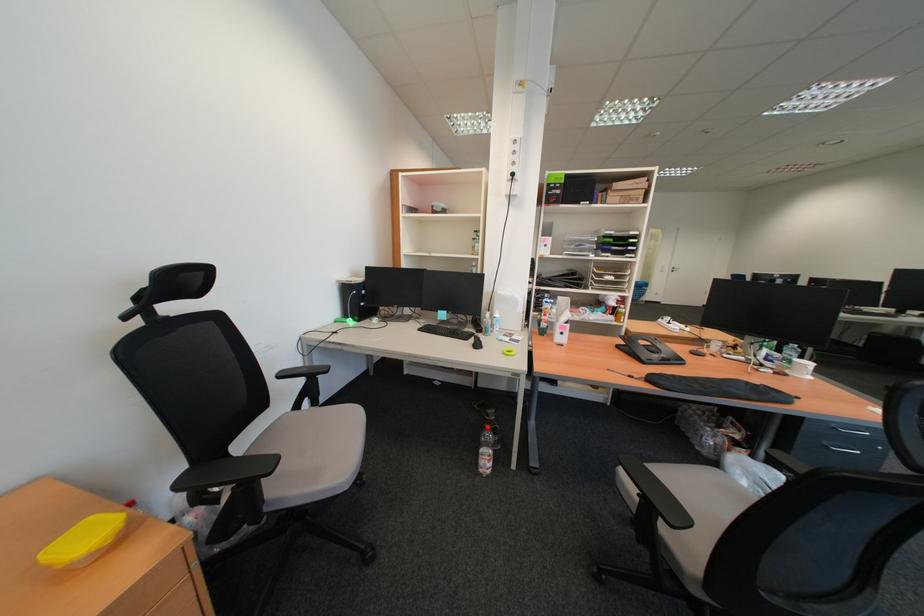
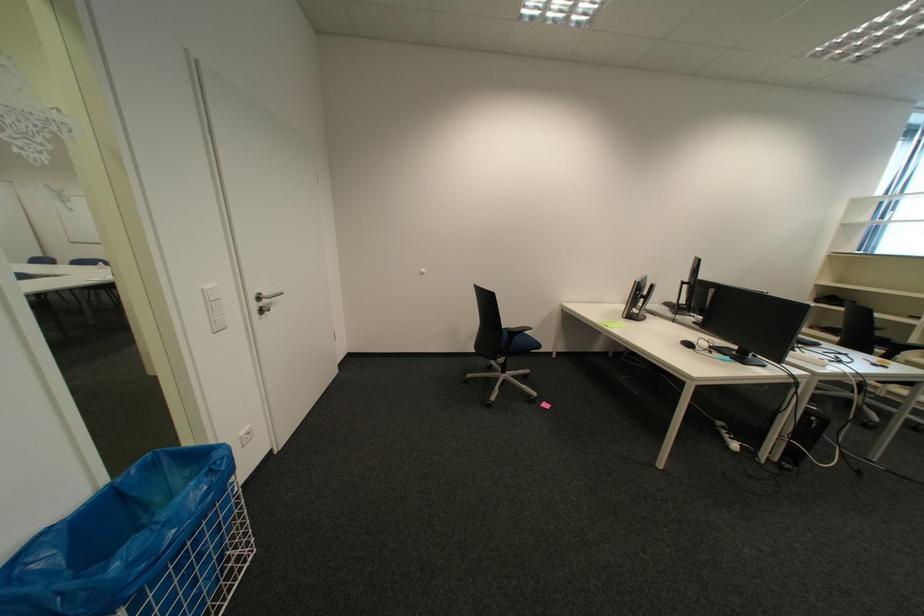
Where in the second image is the point corresponding to (684,270) from the first image?

(266, 307)